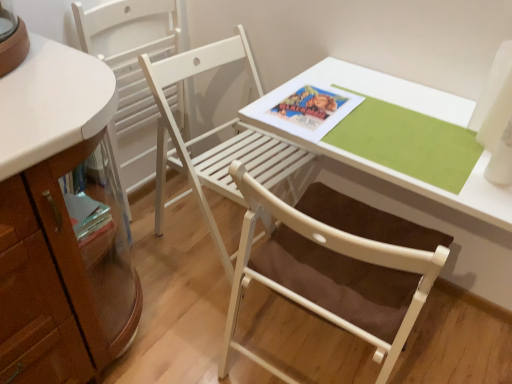
Question: Is white wood chair at center, the second chair from the left, thinner than white wood table at center?

Choices:
 (A) no
 (B) yes

Answer: (A)

Question: Is the position of white wood chair at center, the second chair from the left, more distant than that of white wood table at center?

Choices:
 (A) no
 (B) yes

Answer: (B)

Question: Is white wood chair at center, the second chair from the left, to the left of white wood table at center from the viewer's perspective?

Choices:
 (A) no
 (B) yes

Answer: (B)

Question: Considering the relative sizes of white wood chair at center, the second chair from the left, and white wood table at center in the image provided, is white wood chair at center, the second chair from the left, bigger than white wood table at center?

Choices:
 (A) no
 (B) yes

Answer: (B)

Question: Considering the relative sizes of white wood chair at center, acting as the first chair starting from the right, and white wood table at center in the image provided, is white wood chair at center, acting as the first chair starting from the right, wider than white wood table at center?

Choices:
 (A) no
 (B) yes

Answer: (B)

Question: Considering the positions of point (240, 153) and point (130, 39), is point (240, 153) closer or farther from the camera than point (130, 39)?

Choices:
 (A) farther
 (B) closer

Answer: (B)

Question: Based on their sizes in the image, would you say white wood chair at center, the second chair from the left, is bigger or smaller than white wood chair at left, positioned as the 1th chair in left-to-right order?

Choices:
 (A) small
 (B) big

Answer: (B)

Question: Is white wood chair at center, the second chair from the left, taller or shorter than white wood chair at left, the second chair when ordered from right to left?

Choices:
 (A) short
 (B) tall

Answer: (A)

Question: In the image, is white wood chair at center, the second chair from the left, positioned in front of or behind white wood chair at left, positioned as the 1th chair in left-to-right order?

Choices:
 (A) behind
 (B) front

Answer: (B)

Question: Relative to white wood chair at left, positioned as the 1th chair in left-to-right order, is white wood table at center in front or behind?

Choices:
 (A) behind
 (B) front

Answer: (B)

Question: From a real-world perspective, is white wood table at center positioned above or below white wood chair at left, positioned as the 1th chair in left-to-right order?

Choices:
 (A) below
 (B) above

Answer: (B)

Question: From the image's perspective, is white wood table at center positioned above or below white wood chair at left, positioned as the 1th chair in left-to-right order?

Choices:
 (A) above
 (B) below

Answer: (B)

Question: Looking at their shapes, would you say white wood table at center is wider or thinner than white wood chair at left, positioned as the 1th chair in left-to-right order?

Choices:
 (A) wide
 (B) thin

Answer: (A)

Question: Is white wood table at center situated inside white wood chair at center, the second chair from the left, or outside?

Choices:
 (A) outside
 (B) inside

Answer: (A)

Question: Looking at their shapes, would you say white wood table at center is wider or thinner than white wood chair at center, the second chair from the left?

Choices:
 (A) wide
 (B) thin

Answer: (B)